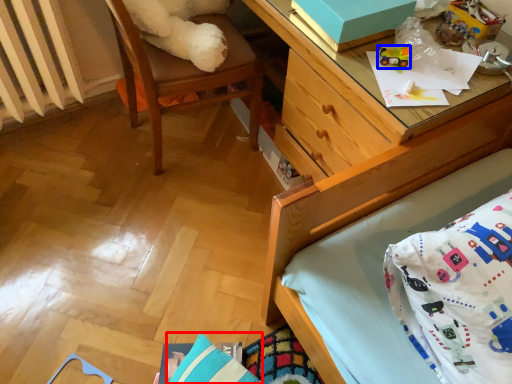
Question: Among these objects, which one is farthest to the camera, pillow (highlighted by a red box) or toy (highlighted by a blue box)?

Choices:
 (A) pillow
 (B) toy

Answer: (B)